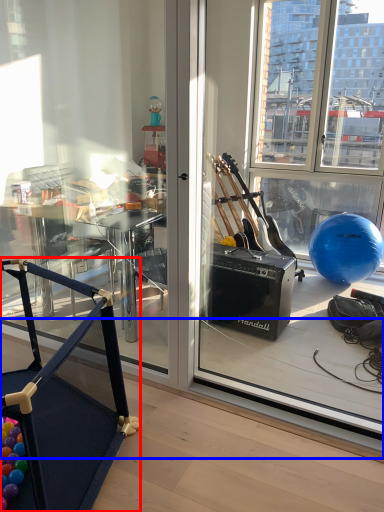
Question: Which object is closer to the camera taking this photo, furniture (highlighted by a red box) or window sill (highlighted by a blue box)?

Choices:
 (A) furniture
 (B) window sill

Answer: (A)